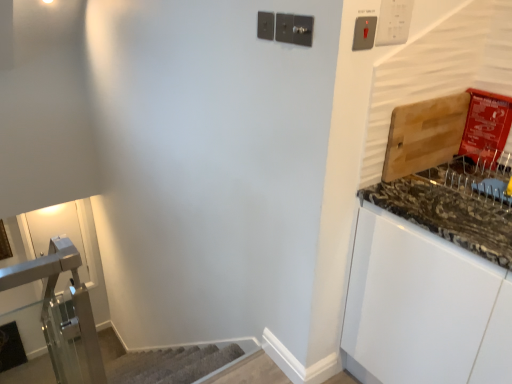
Question: Considering the relative sizes of metallic silver light switch at upper right, the second light switch in the right-to-left sequence, and white plastic light switch at upper right, which is the third light switch in left-to-right order, in the image provided, is metallic silver light switch at upper right, the second light switch in the right-to-left sequence, taller than white plastic light switch at upper right, which is the third light switch in left-to-right order,?

Choices:
 (A) yes
 (B) no

Answer: (B)

Question: From a real-world perspective, does metallic silver light switch at upper right, the second light switch in the right-to-left sequence, stand above white plastic light switch at upper right, the first light switch from the right?

Choices:
 (A) no
 (B) yes

Answer: (A)

Question: Does metallic silver light switch at upper right, which is counted as the 2th light switch, starting from the left, appear on the right side of white plastic light switch at upper right, the first light switch from the right?

Choices:
 (A) yes
 (B) no

Answer: (B)

Question: From the image's perspective, is metallic silver light switch at upper right, which is counted as the 2th light switch, starting from the left, over white plastic light switch at upper right, which is the third light switch in left-to-right order?

Choices:
 (A) no
 (B) yes

Answer: (A)

Question: Considering the relative sizes of metallic silver light switch at upper right, which is counted as the 2th light switch, starting from the left, and white plastic light switch at upper right, which is the third light switch in left-to-right order, in the image provided, is metallic silver light switch at upper right, which is counted as the 2th light switch, starting from the left, thinner than white plastic light switch at upper right, which is the third light switch in left-to-right order,?

Choices:
 (A) no
 (B) yes

Answer: (A)

Question: Looking at the image, does granite/stone cutting board at right seem bigger or smaller compared to satin nickel light switch at upper center, placed as the first light switch when sorted from left to right?

Choices:
 (A) big
 (B) small

Answer: (A)

Question: In the image, is granite/stone cutting board at right positioned in front of or behind satin nickel light switch at upper center, marked as the third light switch in a right-to-left arrangement?

Choices:
 (A) behind
 (B) front

Answer: (B)

Question: Considering the positions of point (500, 226) and point (292, 34), is point (500, 226) closer or farther from the camera than point (292, 34)?

Choices:
 (A) farther
 (B) closer

Answer: (B)

Question: Based on their positions, is granite/stone cutting board at right located to the left or right of satin nickel light switch at upper center, placed as the first light switch when sorted from left to right?

Choices:
 (A) left
 (B) right

Answer: (B)

Question: From their relative heights in the image, would you say white plastic light switch at upper right, which is the third light switch in left-to-right order, is taller or shorter than granite/stone cutting board at right?

Choices:
 (A) short
 (B) tall

Answer: (B)

Question: Is white plastic light switch at upper right, the first light switch from the right, in front of or behind granite/stone cutting board at right in the image?

Choices:
 (A) behind
 (B) front

Answer: (A)

Question: From the image's perspective, is white plastic light switch at upper right, the first light switch from the right, positioned above or below granite/stone cutting board at right?

Choices:
 (A) below
 (B) above

Answer: (B)

Question: Based on their positions, is white plastic light switch at upper right, which is the third light switch in left-to-right order, located to the left or right of granite/stone cutting board at right?

Choices:
 (A) left
 (B) right

Answer: (A)

Question: Visually, is satin nickel light switch at upper center, placed as the first light switch when sorted from left to right, positioned to the left or to the right of white plastic light switch at upper right, which is the third light switch in left-to-right order?

Choices:
 (A) right
 (B) left

Answer: (B)

Question: In terms of size, does satin nickel light switch at upper center, placed as the first light switch when sorted from left to right, appear bigger or smaller than white plastic light switch at upper right, which is the third light switch in left-to-right order?

Choices:
 (A) big
 (B) small

Answer: (B)